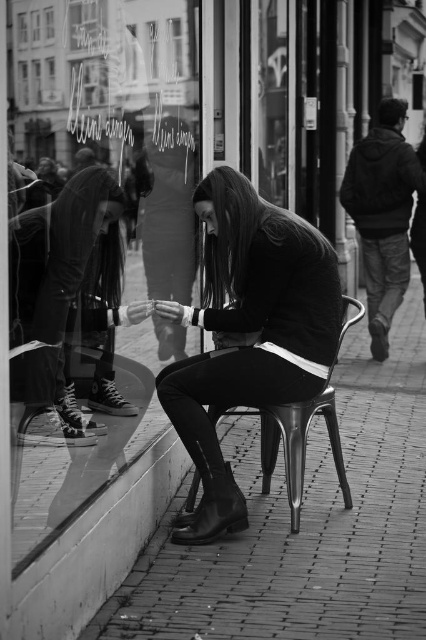
You are a delivery person trying to place a package on the metallic pavement at lower center. However, there is a transparent glass at upper left nearby. Which surface can you safely place the package on without it sliding off?

The metallic pavement at lower center is wider than the transparent glass at upper left, so it is safer to place the package on the metallic pavement at lower center as it has a larger surface area to prevent sliding.

Consider the image. You are a window cleaner and need to clean both the transparent glass at center and the matte black sweater at center. Which object requires a larger cleaning area?

The transparent glass at center requires a larger cleaning area because it is bigger than the matte black sweater at center.